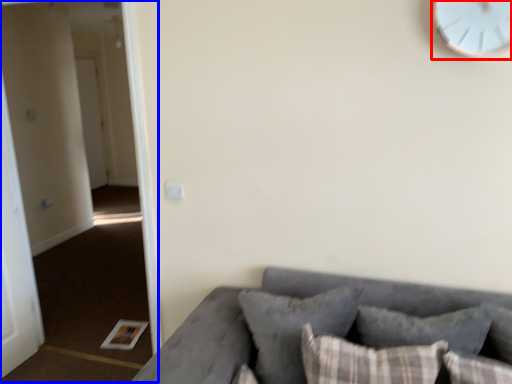
Question: Which object appears closest to the camera in this image, clock (highlighted by a red box) or corridor (highlighted by a blue box)?

Choices:
 (A) clock
 (B) corridor

Answer: (A)